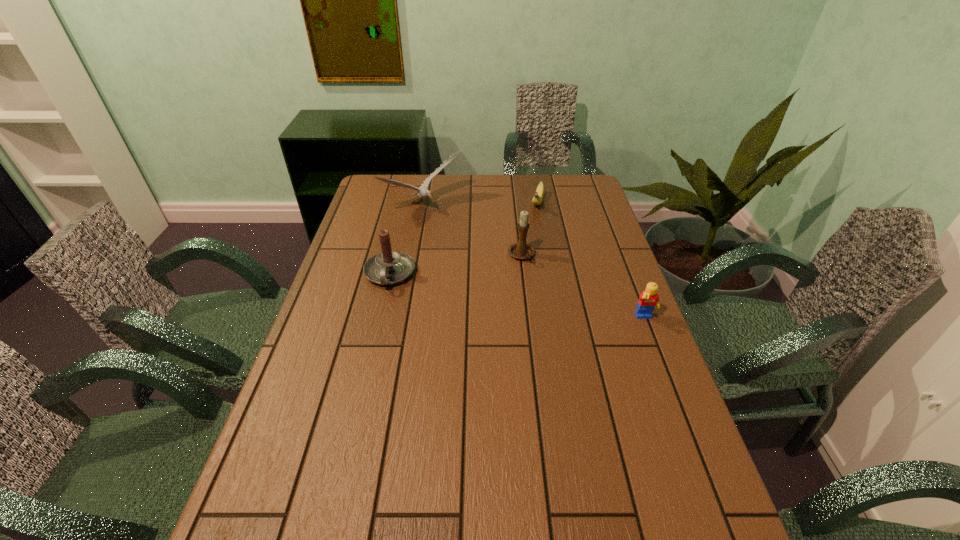
In order to click on free space between the candle and the shortest object in this screenshot , I will do `click(464, 239)`.

Find the location of a particular element. The width and height of the screenshot is (960, 540). free spot between the banana and the gull is located at coordinates (481, 205).

This screenshot has width=960, height=540. I want to click on unoccupied position between the shortest object and the nearest object, so click(591, 261).

At what (x,y) coordinates should I click in order to perform the action: click on free space between the candle and the second shortest object. Please return your answer as a coordinate pair (x, y). Looking at the image, I should click on (517, 296).

Identify the location of vacant space that's between the gull and the candle. (407, 240).

The height and width of the screenshot is (540, 960). Find the location of `free space between the candle holder and the Lego`. free space between the candle holder and the Lego is located at coordinates (583, 287).

I want to click on vacant area that lies between the gull and the candle, so click(407, 240).

The width and height of the screenshot is (960, 540). Find the location of `empty space between the candle and the fourth object from left to right`. empty space between the candle and the fourth object from left to right is located at coordinates (464, 239).

This screenshot has width=960, height=540. I want to click on blank region between the rightmost object and the candle, so [x=517, y=296].

At what (x,y) coordinates should I click in order to perform the action: click on free area in between the candle holder and the candle. Please return your answer as a coordinate pair (x, y). This screenshot has height=540, width=960. Looking at the image, I should click on pos(456,265).